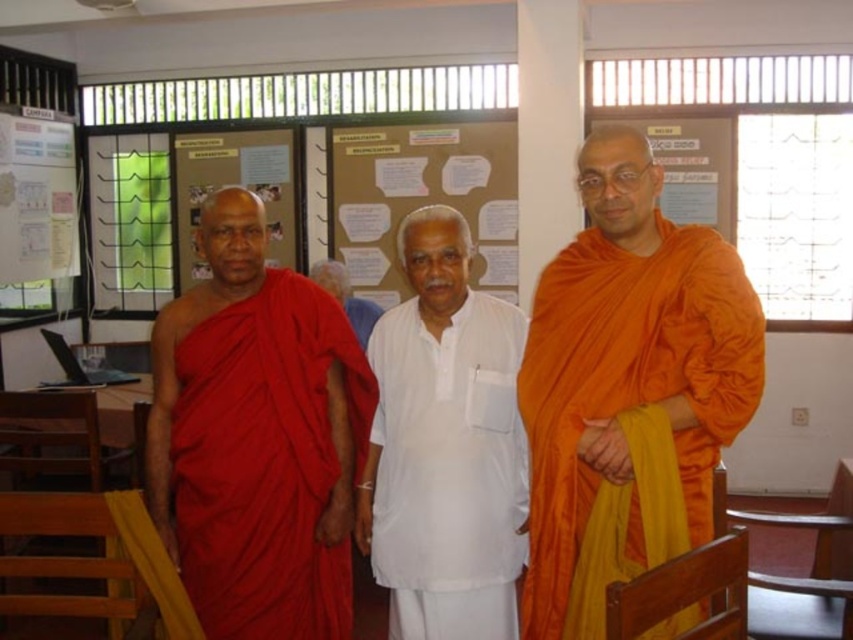
You are an observer in the scene and want to know which clothing item is taller between the matte red robe at center and the white cotton shirt at center. Which one is taller?

The matte red robe at center is taller than the white cotton shirt at center according to the description.

You are standing at the point with coordinates point (x=267, y=428) and want to move to the point (x=706, y=252). Which direction should you move in to reach your destination?

You should move forward because point (x=706, y=252) is in front of point (x=267, y=428).

You are organizing a seating arrangement for a group discussion and need to ensure there is enough space between the two participants wearing the matte red robe at center and the white cotton shirt at center. Based on their clothing widths, which participant requires more space on their seat?

The matte red robe at center might be wider than the white cotton shirt at center, so the participant wearing the matte red robe at center would require more space on their seat to accommodate the width of the robe.